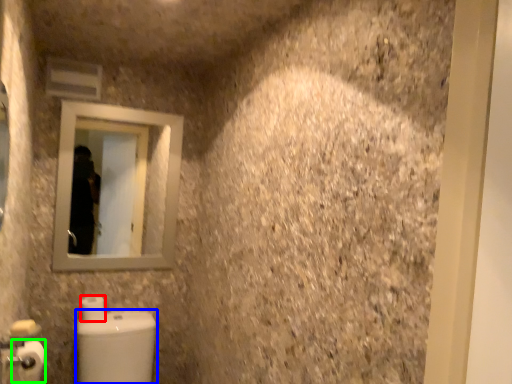
Question: Which object is the closest to the toilet paper (highlighted by a red box)? Choose among these: toilet bowl (highlighted by a blue box) or toilet paper (highlighted by a green box).

Choices:
 (A) toilet bowl
 (B) toilet paper

Answer: (A)